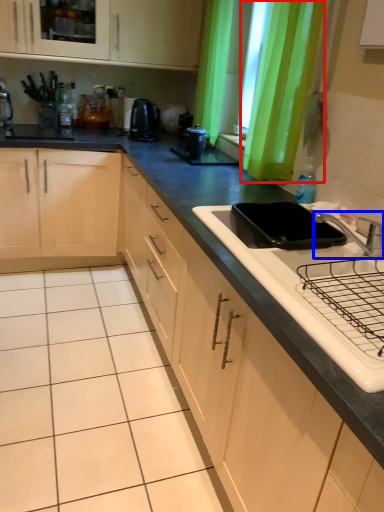
Question: Among these objects, which one is farthest to the camera, curtain (highlighted by a red box) or tap (highlighted by a blue box)?

Choices:
 (A) curtain
 (B) tap

Answer: (A)